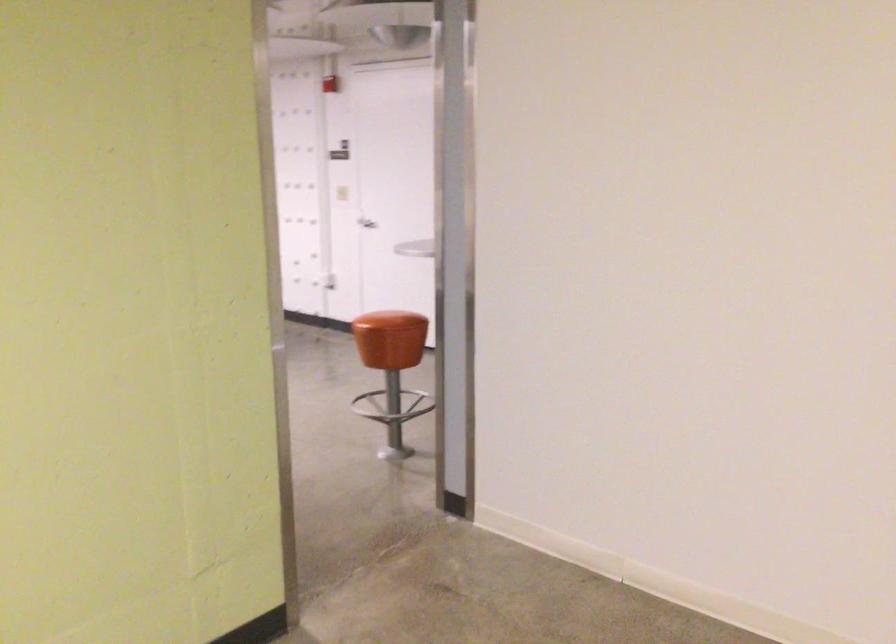
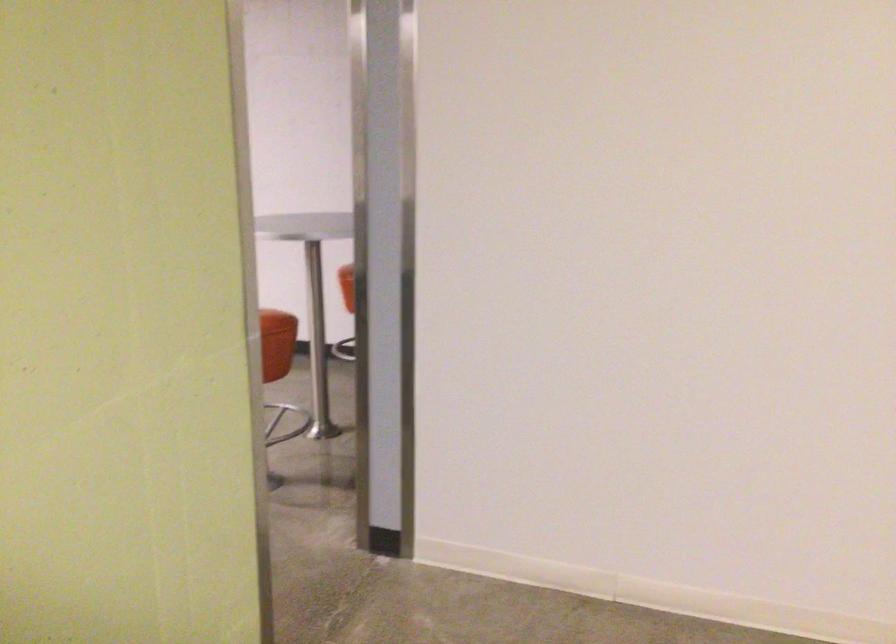
What movement of the cameraman would produce the second image?

The movement direction of the cameraman is left, forward.